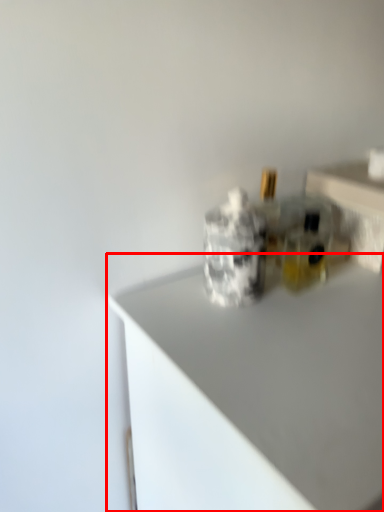
Question: From the image's perspective, considering the relative positions of countertop (annotated by the red box) and table in the image provided, where is countertop (annotated by the red box) located with respect to the staircase?

Choices:
 (A) below
 (B) above

Answer: (A)